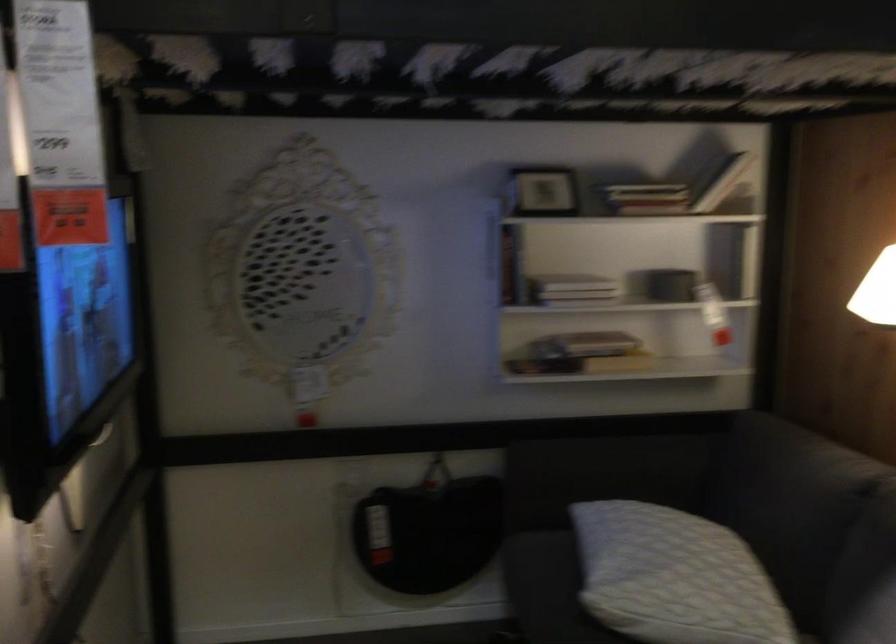
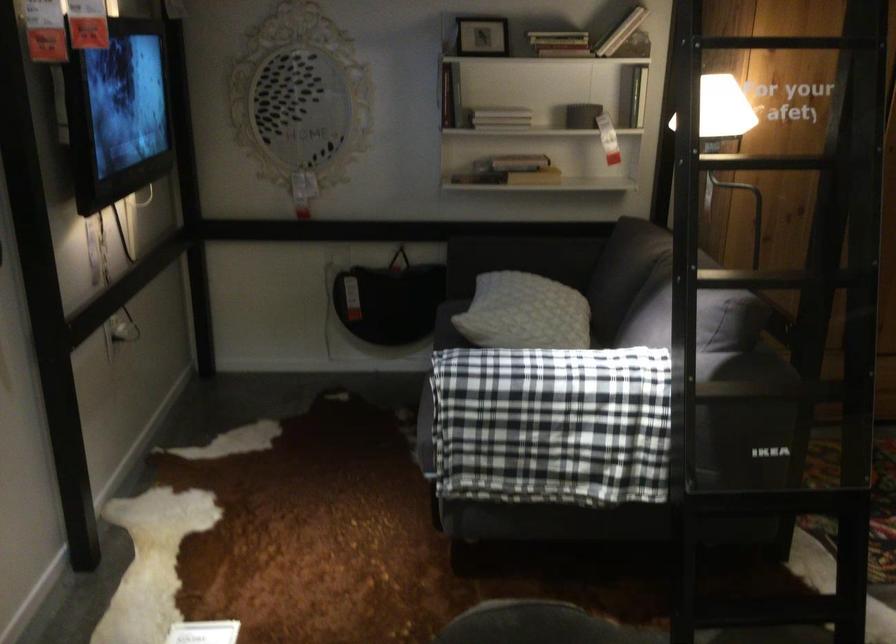
Where in the second image is the point corresponding to point 651,204 from the first image?

(558, 43)